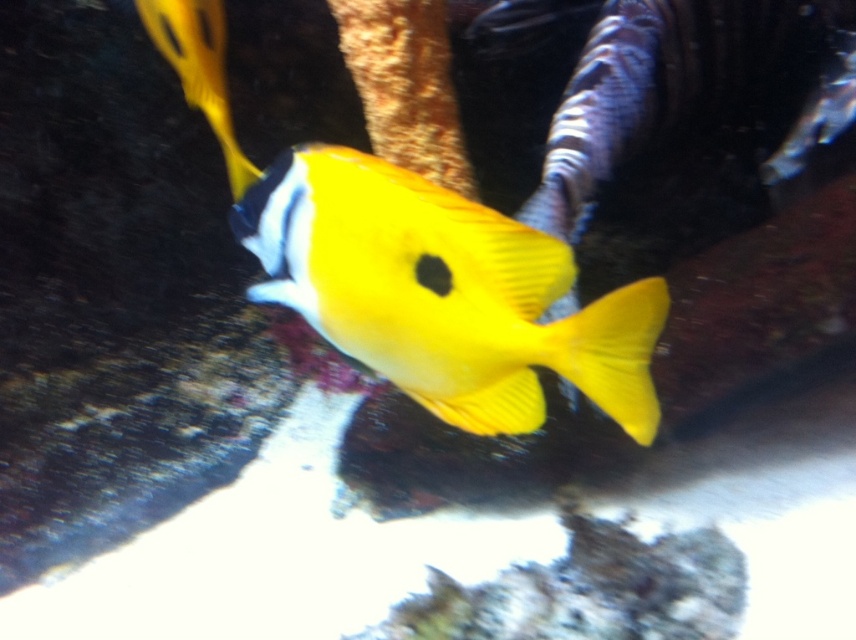
You are an underwater photographer aiming to capture the yellow matte fish at center and the yellow matte fish at upper left in a single frame. Based on their positions and sizes, which fish should you focus on to ensure both are clearly visible in your shot?

The yellow matte fish at center is wider than the yellow matte fish at upper left, so focusing on the fish at center will help ensure both are visible as it takes up more space in the frame.

You are a marine biologist observing two yellow matte fish in the image. Which one is positioned closer to you, the yellow matte fish at center or the yellow matte fish at upper left?

The yellow matte fish at center is closer to the viewer than the yellow matte fish at upper left.

You are a marine biologist observing the fish in the image. You notice two points marked on the fish. The first point is at coordinates point (516, 328) and the second at point (235, 188). Which of these points is closer to the camera?

Point (516, 328) is closer to the camera than point (235, 188).